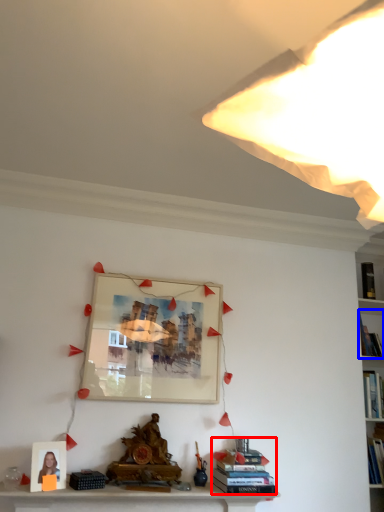
Question: Which point is closer to the camera, book (highlighted by a red box) or book (highlighted by a blue box)?

Choices:
 (A) book
 (B) book

Answer: (A)